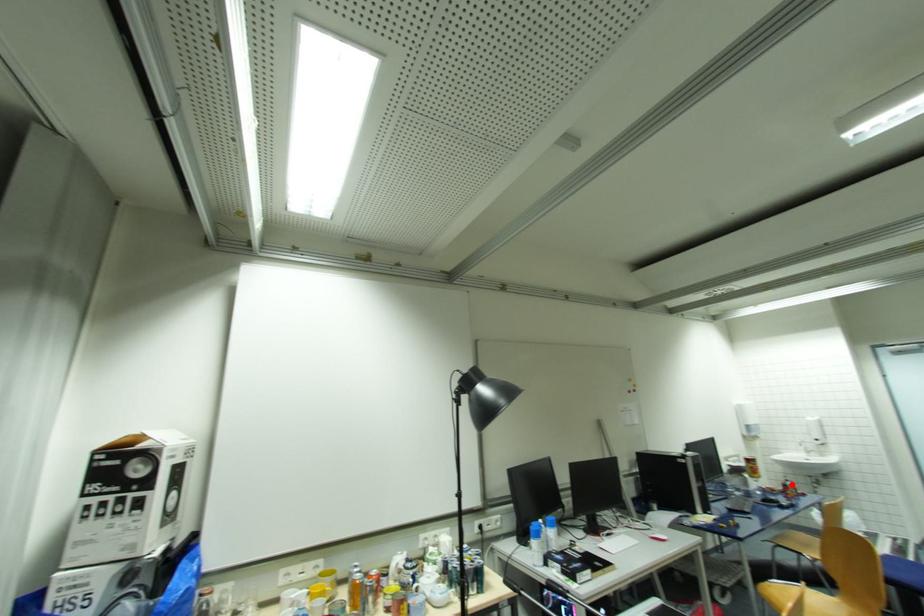
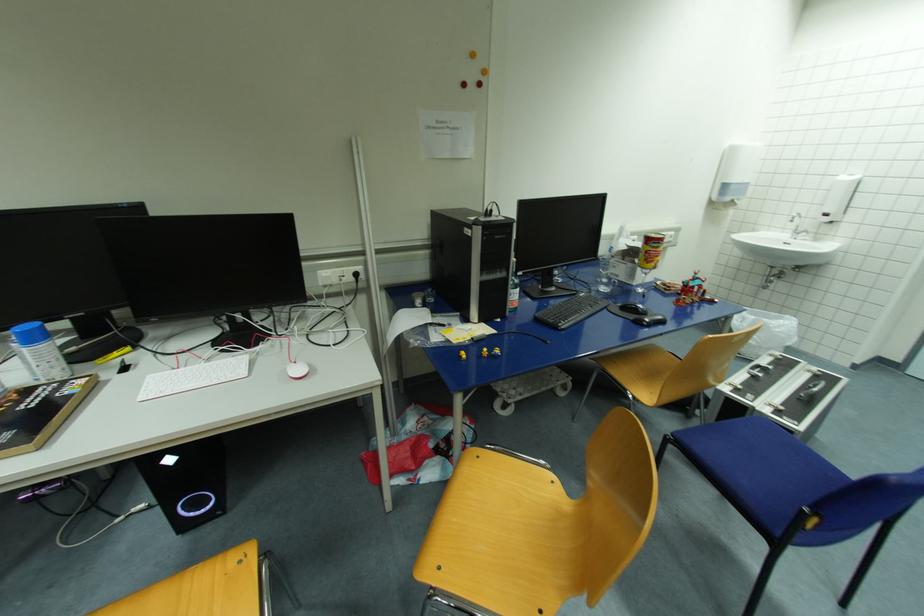
Question: I am providing you with two images of the same scene from different viewpoints. A red point is shown in image1. For the corresponding object point in image2, is it positioned nearer or farther from the camera?

Choices:
 (A) Nearer
 (B) Farther

Answer: (B)